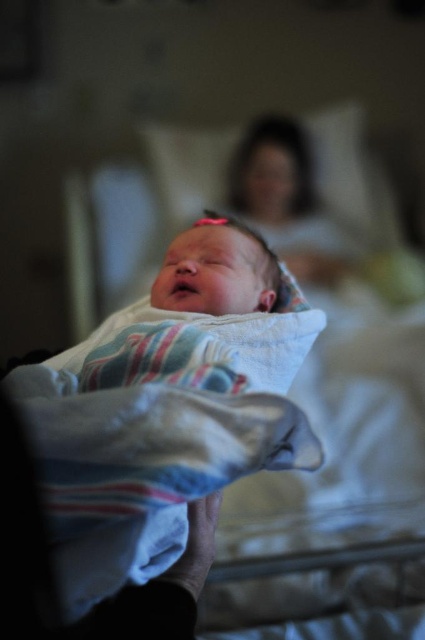
Question: Does smooth skin mother at upper center appear over white soft blanket at center?

Choices:
 (A) yes
 (B) no

Answer: (A)

Question: Is smooth skin mother at upper center further to camera compared to white soft blanket at center?

Choices:
 (A) no
 (B) yes

Answer: (B)

Question: Which object appears closest to the camera in this image?

Choices:
 (A) white soft blanket at center
 (B) smooth skin mother at upper center

Answer: (A)

Question: Is smooth skin mother at upper center below white soft blanket at center?

Choices:
 (A) yes
 (B) no

Answer: (B)

Question: Among these points, which one is nearest to the camera?

Choices:
 (A) 198,589
 (B) 312,218

Answer: (A)

Question: Among these points, which one is farthest from the camera?

Choices:
 (A) (277, 157)
 (B) (198, 305)

Answer: (A)